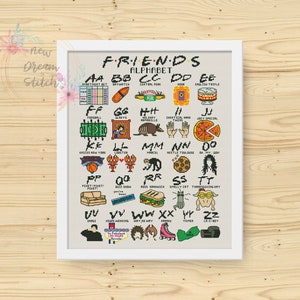
Locate an element on the screen. The width and height of the screenshot is (300, 300). poster is located at coordinates (94, 63).